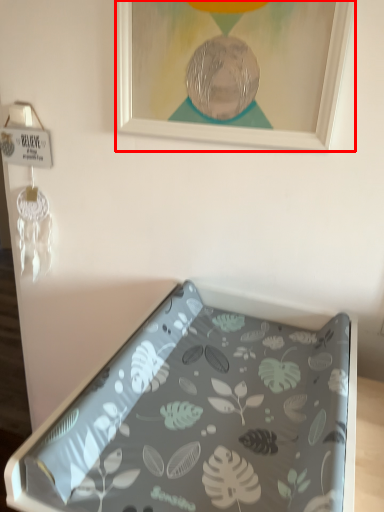
Question: In this image, where is picture frame (annotated by the red box) located relative to furniture?

Choices:
 (A) right
 (B) left

Answer: (B)